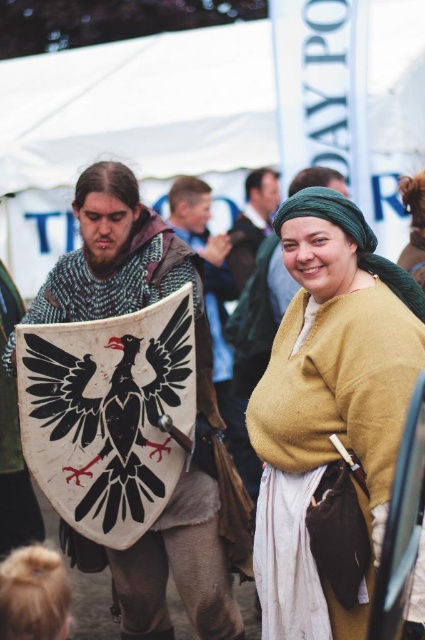
Question: Is knitted woolen sweater at center above green woven headscarf at center?

Choices:
 (A) yes
 (B) no

Answer: (B)

Question: Where is white leather shield at center located in relation to knitted woolen sweater at center in the image?

Choices:
 (A) right
 (B) left

Answer: (B)

Question: Is matte yellow sweater at center smaller than black leather shield at center?

Choices:
 (A) no
 (B) yes

Answer: (A)

Question: Which of the following is the farthest from the observer?

Choices:
 (A) knitted woolen sweater at center
 (B) matte yellow sweater at center

Answer: (A)

Question: Based on their relative distances, which object is farther from the green woven headscarf at center?

Choices:
 (A) matte yellow sweater at center
 (B) knitted woolen sweater at center
 (C) white leather shield at center
 (D) black leather shield at center

Answer: (D)

Question: Which of the following is the farthest from the observer?

Choices:
 (A) (297, 497)
 (B) (238, 387)
 (C) (414, 208)
 (D) (189, 212)

Answer: (D)